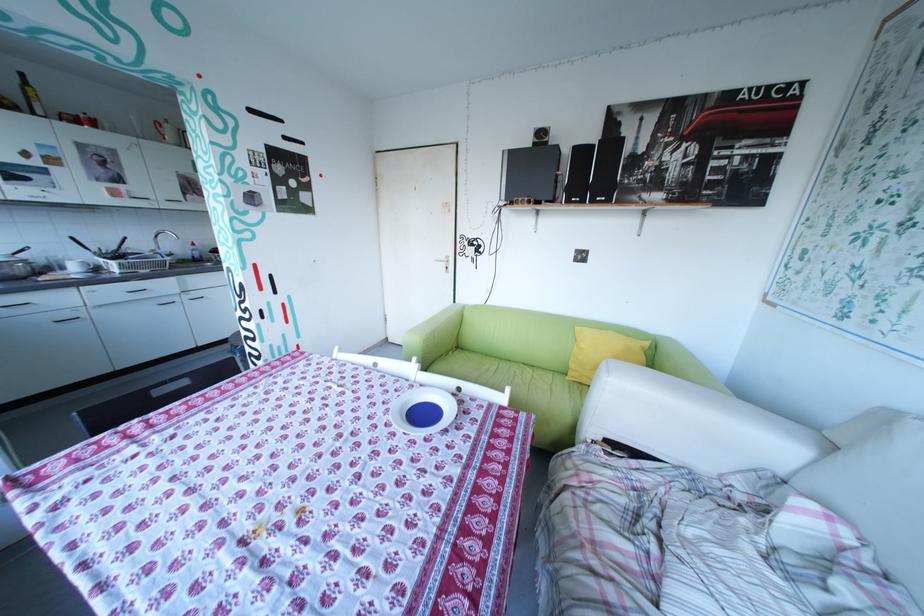
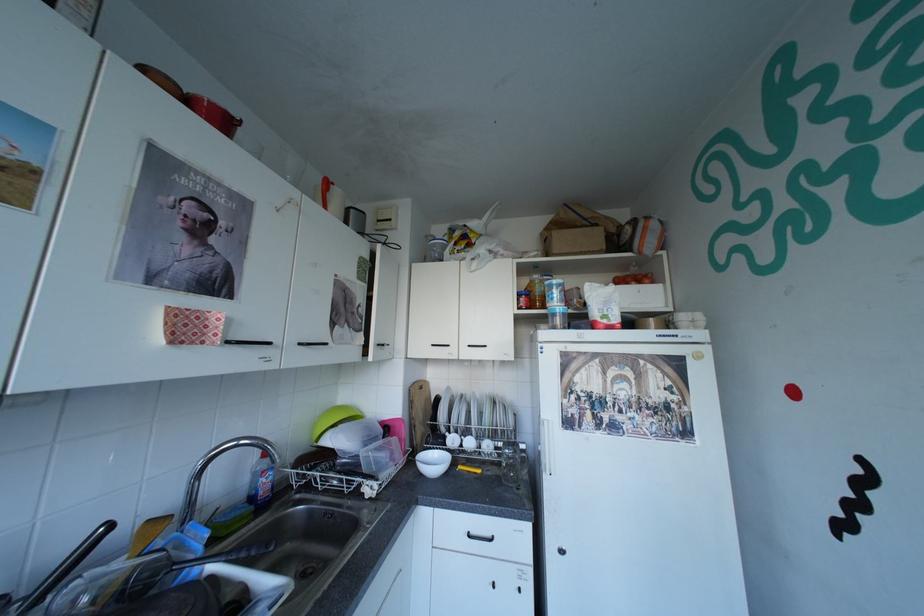
In the scene shown: In a continuous first-person perspective shot, in which direction is the camera moving?

The cameraman moved toward left, forward.